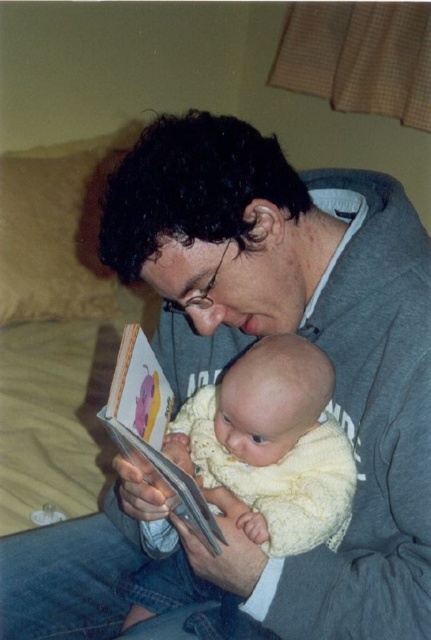
You are a photographer trying to capture the baby in focus. The soft yellow knit at center and the hardcover book at center are both in the frame. Which object is closer to the camera?

The soft yellow knit at center is taller than the hardcover book at center, so it is closer to the camera.

You are a delivery robot standing at the point marked as point (306,392). You need to deliver a package to the bed with beige bedding in the background. The robot has a maximum reach of 30 inches. Can you reach the bed from your current position?

The distance between point (306,392) and the viewer is 28.03 inches. Since the robot has a maximum reach of 30 inches, it can reach the bed with beige bedding in the background from its current position.

Consider the image. You are a photographer trying to capture the baby in focus while blurring the background. Which object should you focus on to ensure the baby is sharp? Please choose between the soft yellow knit at center and the hardcover book at center.

The soft yellow knit at center has a larger size compared to hardcover book at center, so focusing on the soft yellow knit at center will ensure the baby is sharp as it is closer to the camera.